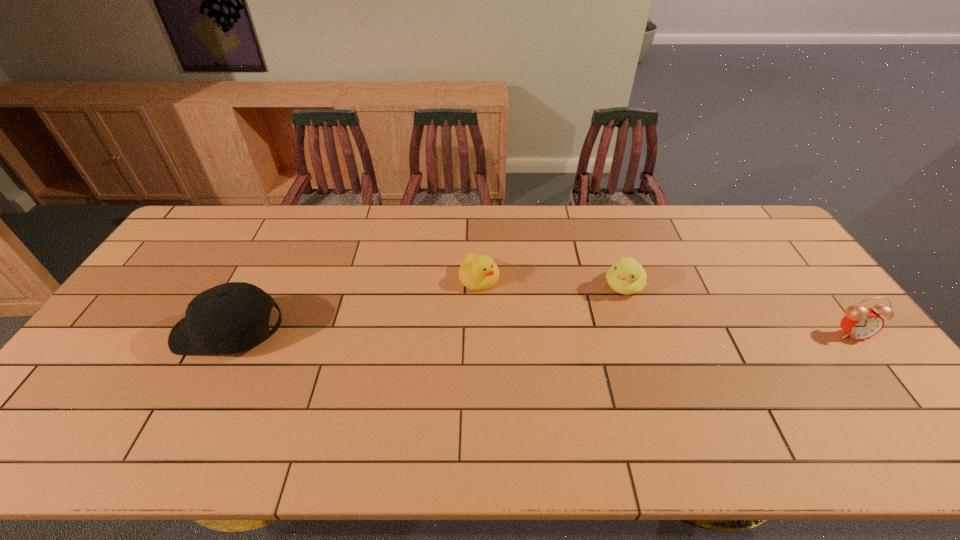
Image resolution: width=960 pixels, height=540 pixels. I want to click on vacant space on the desktop that is between the baseball cap and the alarm clock and is positioned at the beak of the right duckling, so click(588, 333).

Identify the location of vacant spot on the desktop that is between the leftmost object and the alarm clock and is positioned on the face of the third object from right to left. This screenshot has width=960, height=540. (531, 333).